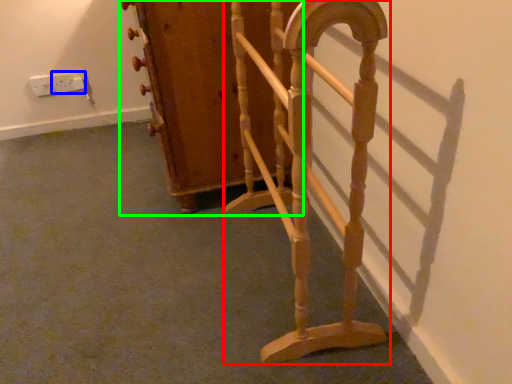
Question: Which is farther away from furniture (highlighted by a red box)? electric outlet (highlighted by a blue box) or furniture (highlighted by a green box)?

Choices:
 (A) electric outlet
 (B) furniture

Answer: (A)